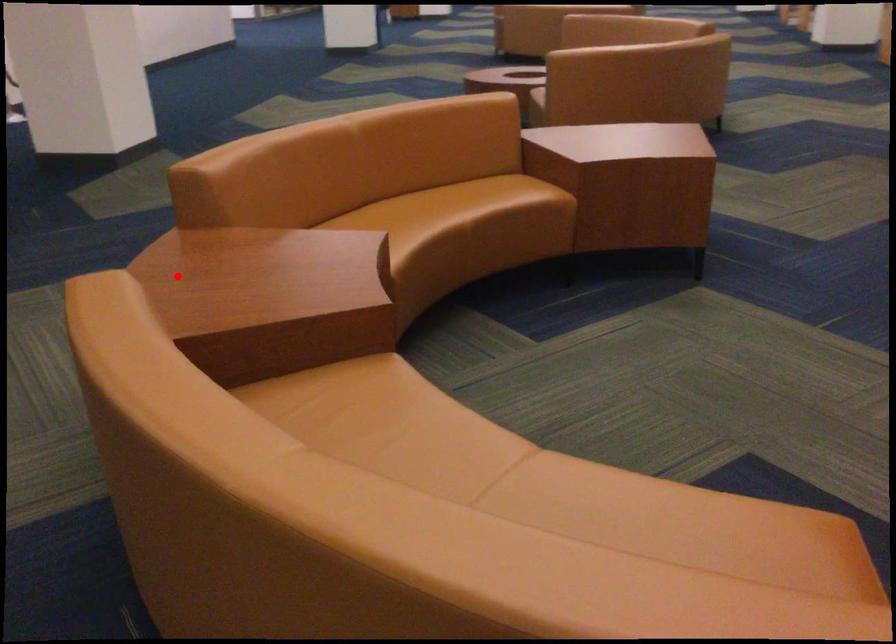
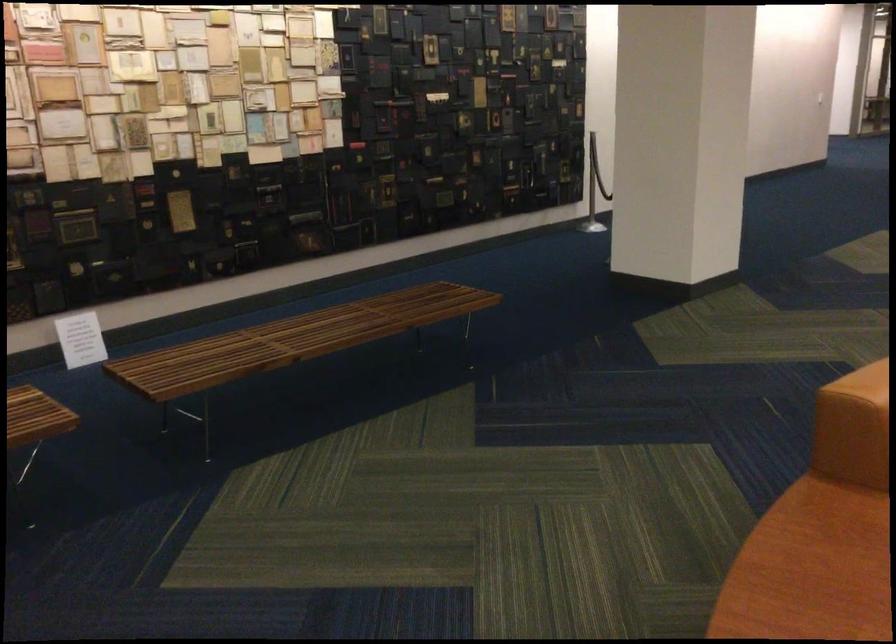
Question: I am providing you with two images of the same scene from different viewpoints. Given a red point in image1, look at the same physical point in image2. Is it:

Choices:
 (A) Closer to the viewpoint
 (B) Farther from the viewpoint

Answer: (A)